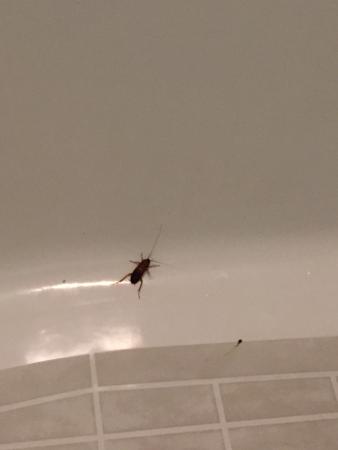
Locate an element on the screen. sink is located at coordinates click(x=266, y=372).